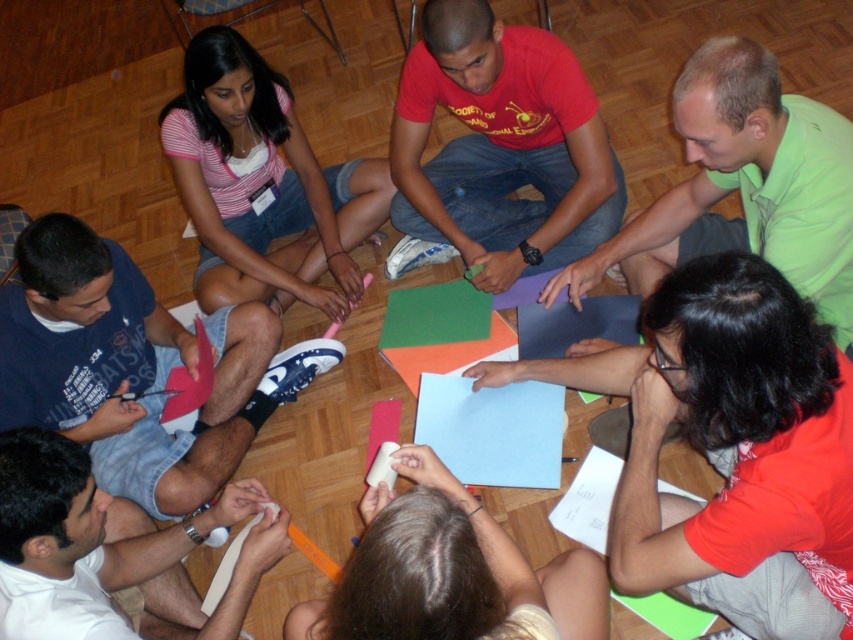
Does blue cotton t-shirt at lower left have a lesser height compared to smooth white paper at lower center?

In fact, blue cotton t-shirt at lower left may be taller than smooth white paper at lower center.

Which is behind, point (144, 401) or point (457, 486)?

Positioned behind is point (144, 401).

The width and height of the screenshot is (853, 640). Identify the location of blue cotton t-shirt at lower left. (126, 369).

The height and width of the screenshot is (640, 853). Find the location of `blue cotton t-shirt at lower left`. blue cotton t-shirt at lower left is located at coordinates click(126, 369).

Is point (664, 212) positioned after point (74, 525)?

Yes.

Is green matte shirt at upper right wider than white matte fabric at lower left?

Yes.

Between point (772, 164) and point (218, 609), which one is positioned in front?

Point (772, 164) is more forward.

This screenshot has height=640, width=853. In order to click on green matte shirt at upper right in this screenshot , I will do pyautogui.click(x=743, y=186).

Who is more distant from viewer, (26,264) or (215,163)?

Positioned behind is point (215,163).

Who is more forward, (152, 296) or (256, 266)?

Point (152, 296) is in front.

Which is behind, point (55, 385) or point (274, 136)?

Point (274, 136)

At what (x,y) coordinates should I click in order to perform the action: click on blue cotton t-shirt at lower left. Please return your answer as a coordinate pair (x, y). This screenshot has width=853, height=640. Looking at the image, I should click on (126, 369).